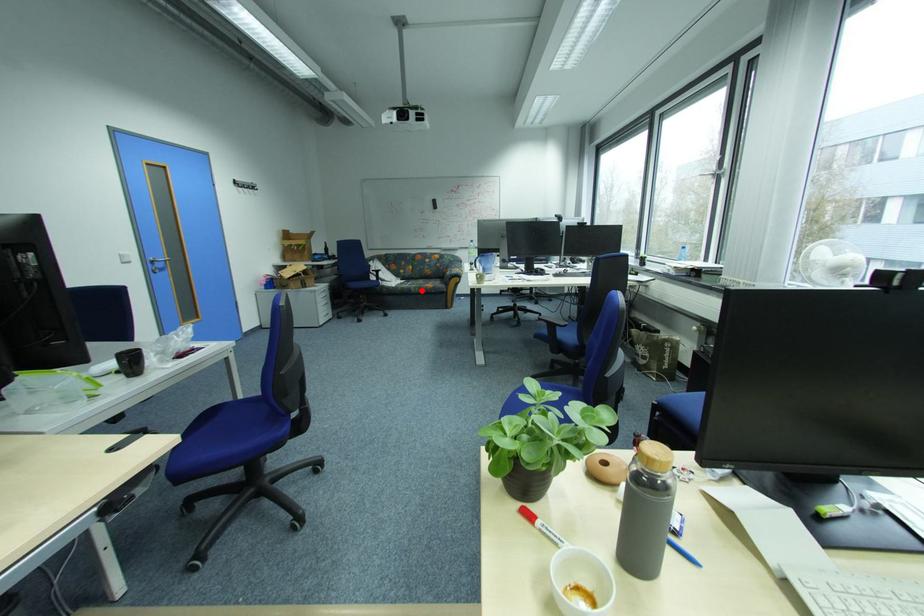
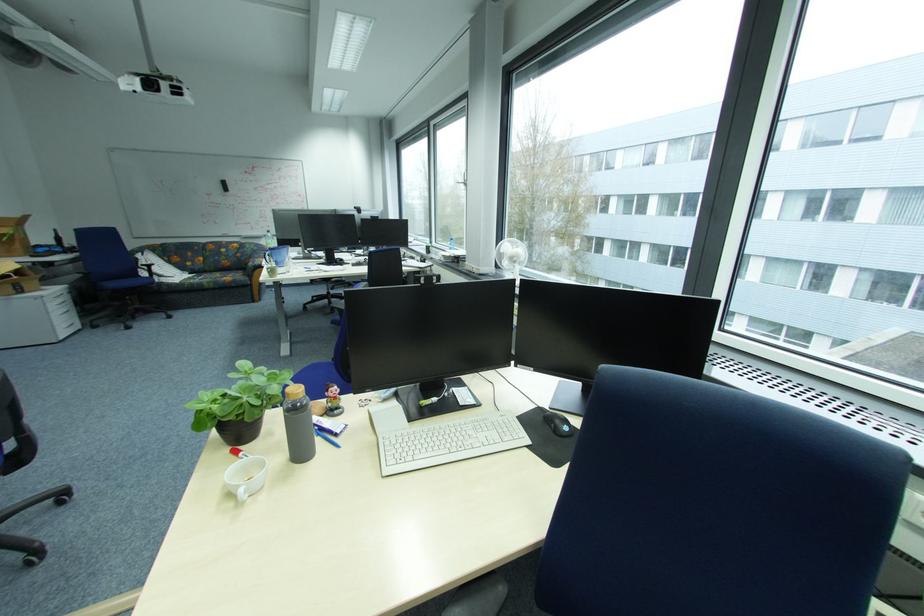
The point at the highlighted location is marked in the first image. Where is the corresponding point in the second image?

(214, 286)